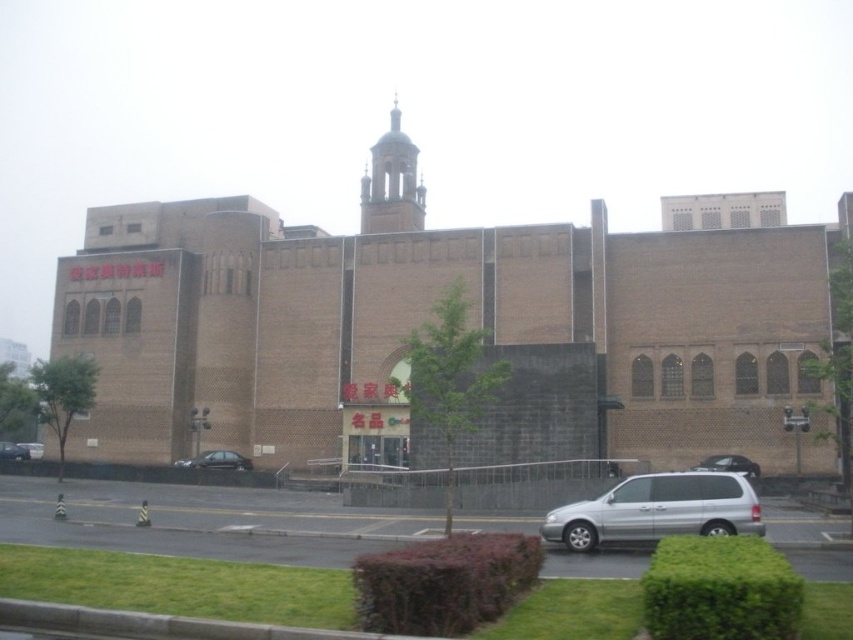
This screenshot has height=640, width=853. In order to click on black matte car at center in this screenshot , I will do `click(216, 460)`.

Can you confirm if black matte car at center is positioned to the left of matte black sedan at lower left?

Incorrect, black matte car at center is not on the left side of matte black sedan at lower left.

Identify the location of black matte car at center. The image size is (853, 640). (216, 460).

You are a GUI agent. You are given a task and a screenshot of the screen. Output one action in this format:
    pyautogui.click(x=<x>, y=<y>)
    Task: Click on the black matte car at center
    The width and height of the screenshot is (853, 640).
    Given the screenshot: What is the action you would take?
    (216, 460)

Is black matte car at center above satin black sedan at lower right?

Incorrect, black matte car at center is not positioned above satin black sedan at lower right.

Which is more to the left, black matte car at center or satin black sedan at lower right?

black matte car at center is more to the left.

Find the location of a particular element. black matte car at center is located at coordinates (216, 460).

Is silver metallic van at center taller than matte black sedan at lower left?

Correct, silver metallic van at center is much taller as matte black sedan at lower left.

Does silver metallic van at center appear on the right side of matte black sedan at lower left?

Correct, you'll find silver metallic van at center to the right of matte black sedan at lower left.

Identify the location of silver metallic van at center. (657, 509).